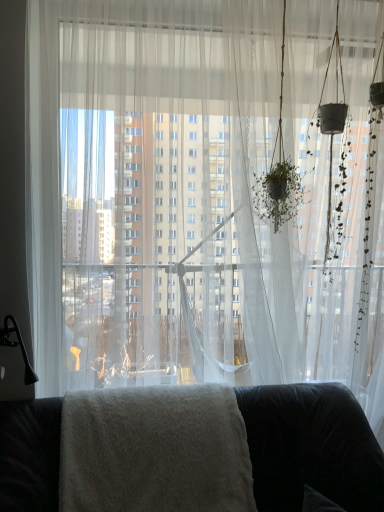
What do you see at coordinates (311, 447) in the screenshot? The height and width of the screenshot is (512, 384). I see `white fluffy blanket at center` at bounding box center [311, 447].

Where is `white fluffy blanket at center`? white fluffy blanket at center is located at coordinates (311, 447).

What is the approximate width of white fluffy blanket at center?

30.11 inches.

This screenshot has height=512, width=384. In order to click on white fluffy blanket at center in this screenshot , I will do `click(311, 447)`.